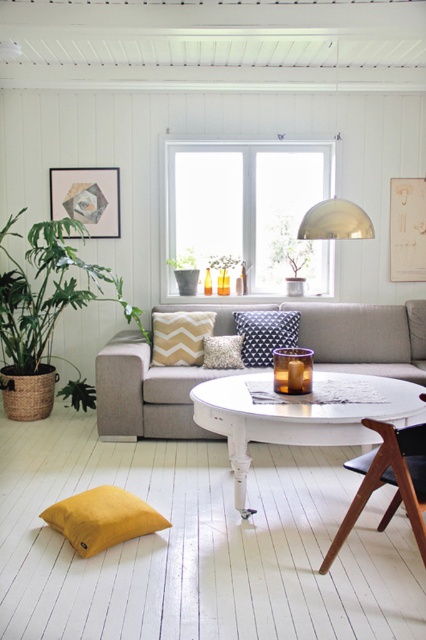
Is point (327, 266) positioned before point (247, 342)?

That is False.

Can you confirm if white glass window at center is thinner than navy blue textured pillow at center?

No, white glass window at center is not thinner than navy blue textured pillow at center.

The width and height of the screenshot is (426, 640). Find the location of `white glass window at center`. white glass window at center is located at coordinates (249, 208).

Does green leafy plant in woven pot at left have a lesser height compared to textured cream pillow at center?

No.

Can you confirm if green leafy plant in woven pot at left is positioned above textured cream pillow at center?

Correct, green leafy plant in woven pot at left is located above textured cream pillow at center.

Locate an element on the screen. The width and height of the screenshot is (426, 640). green leafy plant in woven pot at left is located at coordinates (43, 312).

Which of these two, polished brass dome at upper center or textured cream pillow at center, stands taller?

polished brass dome at upper center is taller.

Which of these two, polished brass dome at upper center or textured cream pillow at center, stands shorter?

textured cream pillow at center

Is point (313, 224) in front of point (219, 360)?

Yes, point (313, 224) is in front of point (219, 360).

What are the coordinates of `polished brass dome at upper center` in the screenshot? It's located at (334, 221).